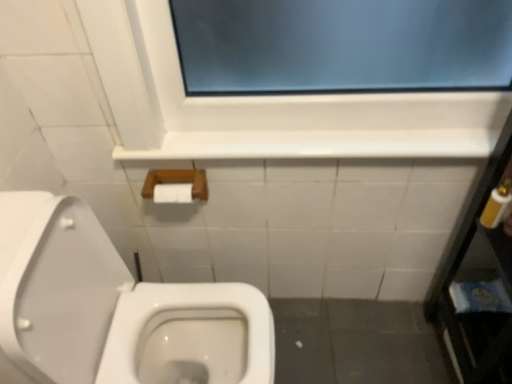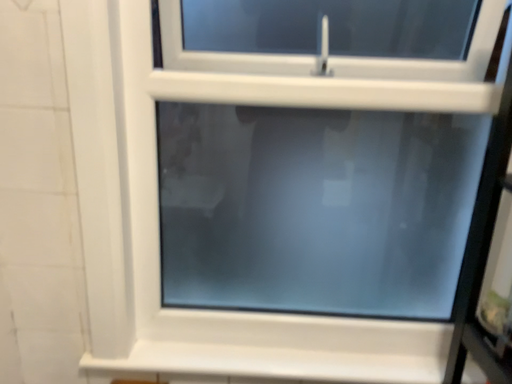
Question: Which way did the camera rotate in the video?

Choices:
 (A) rotated downward
 (B) rotated upward

Answer: (B)